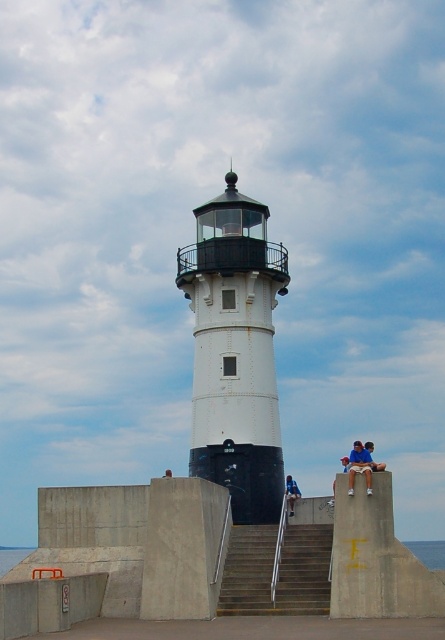
Is white matte/lightweight tower at center further to camera compared to blue denim jeans at lower center?

That is False.

Can you confirm if white matte/lightweight tower at center is taller than blue denim jeans at lower center?

Yes.

Who is more distant from viewer, [259,500] or [295,493]?

Point [295,493]

Locate an element on the screen. white matte/lightweight tower at center is located at coordinates (235, 352).

Does concrete stairs at center have a smaller size compared to blue cotton shirt at right?

Correct, concrete stairs at center occupies less space than blue cotton shirt at right.

Who is more distant from viewer, (231, 576) or (356, 458)?

The point (356, 458) is behind.

Identify the location of concrete stairs at center. (279, 570).

Does white matte/lightweight tower at center lie behind blue cotton shirt at right?

Yes, it is.

Between point (242, 472) and point (352, 464), which one is positioned in front?

Point (352, 464) is in front.

This screenshot has height=640, width=445. In order to click on white matte/lightweight tower at center in this screenshot , I will do `click(235, 352)`.